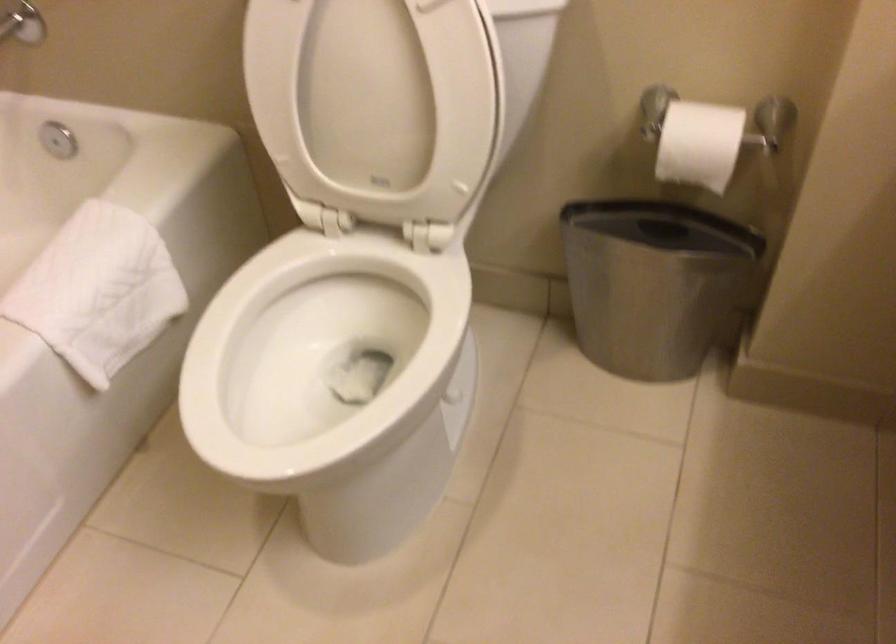
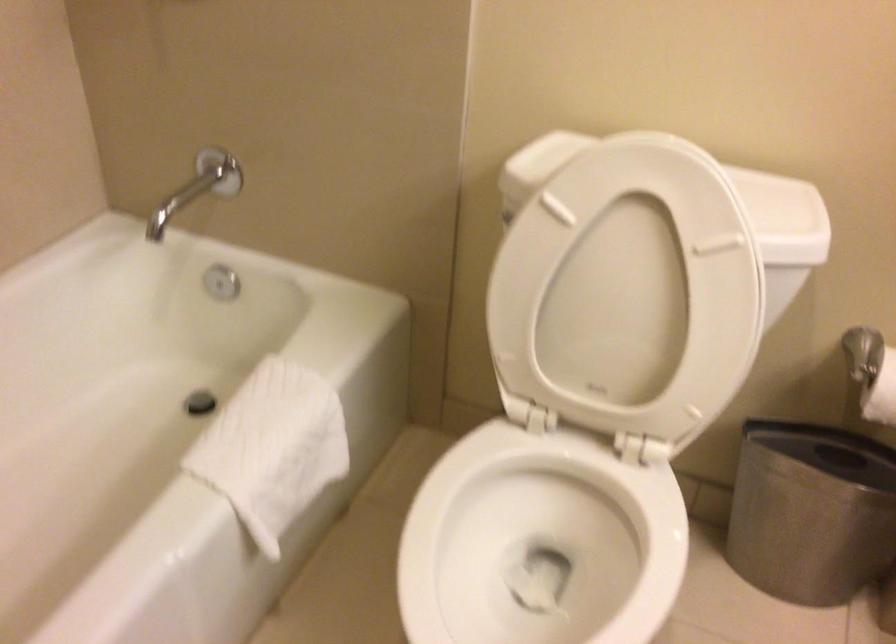
In the second image, find the point that corresponds to the point at 362,343 in the first image.

(539, 542)